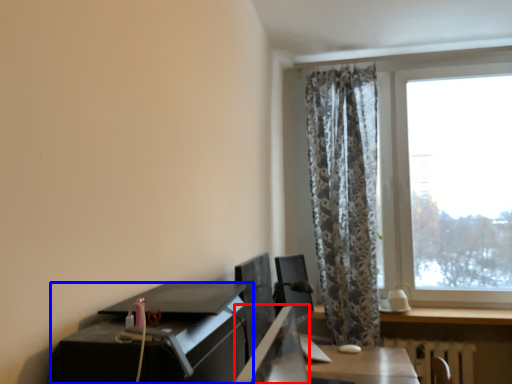
Question: Which of the following is the farthest to the observer, desktop (highlighted by a red box) or desk (highlighted by a blue box)?

Choices:
 (A) desktop
 (B) desk

Answer: (B)